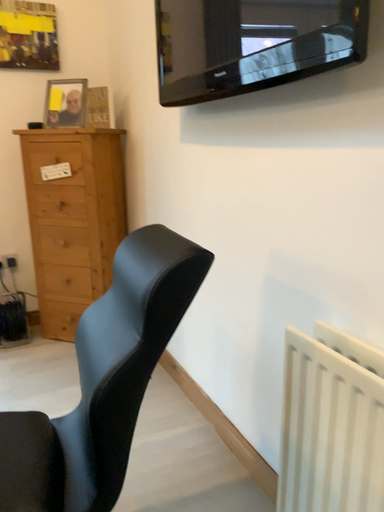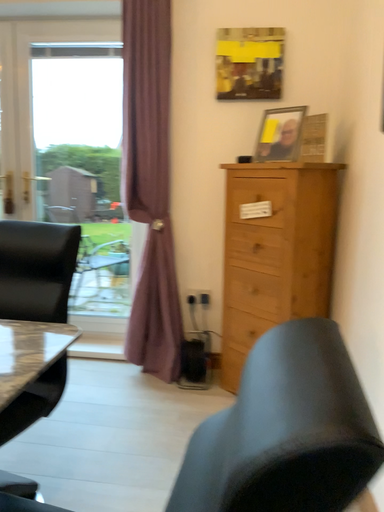
Question: Which way did the camera rotate in the video?

Choices:
 (A) rotated upward
 (B) rotated downward

Answer: (A)